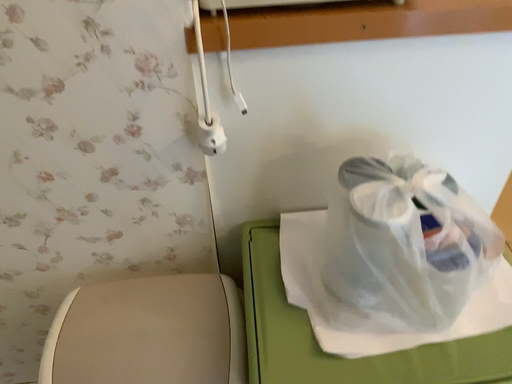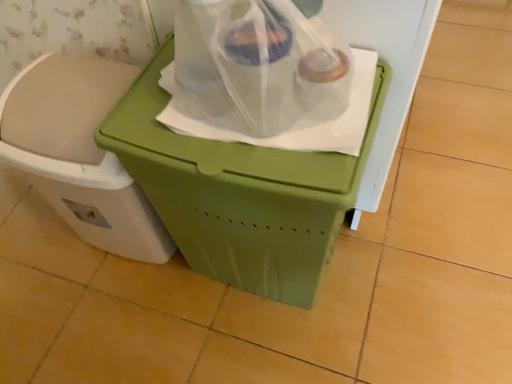
Question: Which way did the camera rotate in the video?

Choices:
 (A) rotated downward
 (B) rotated upward

Answer: (A)